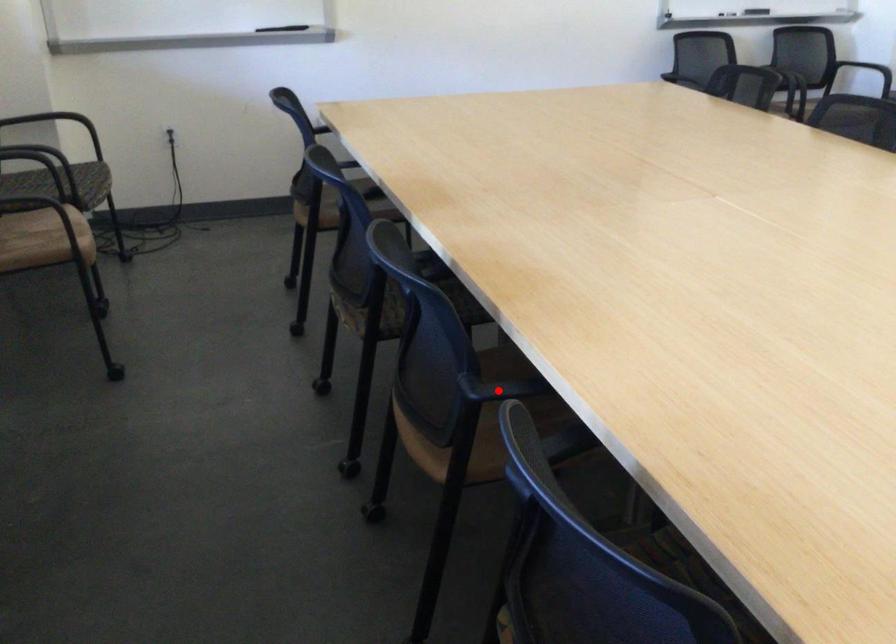
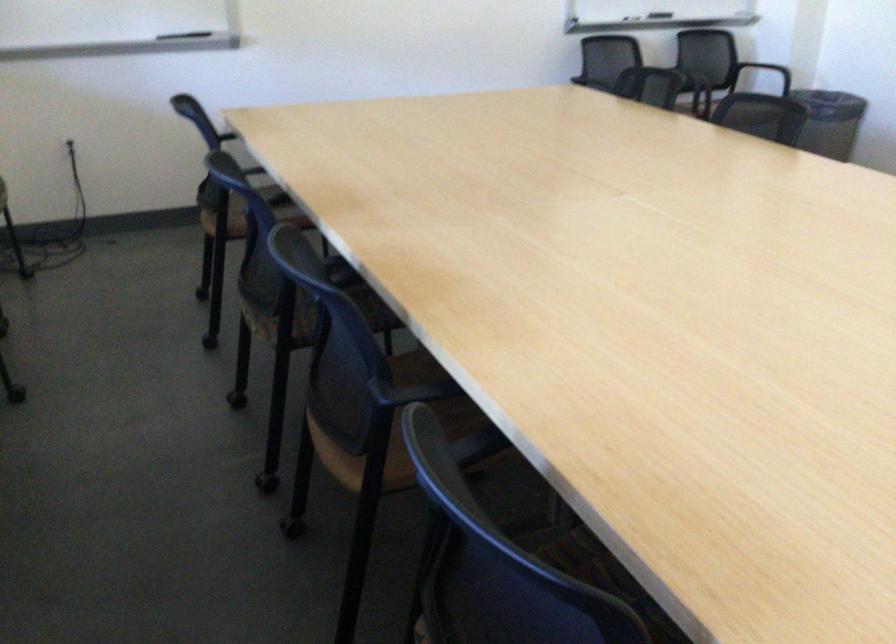
Find the pixel in the second image that matches the highlighted location in the first image.

(409, 392)